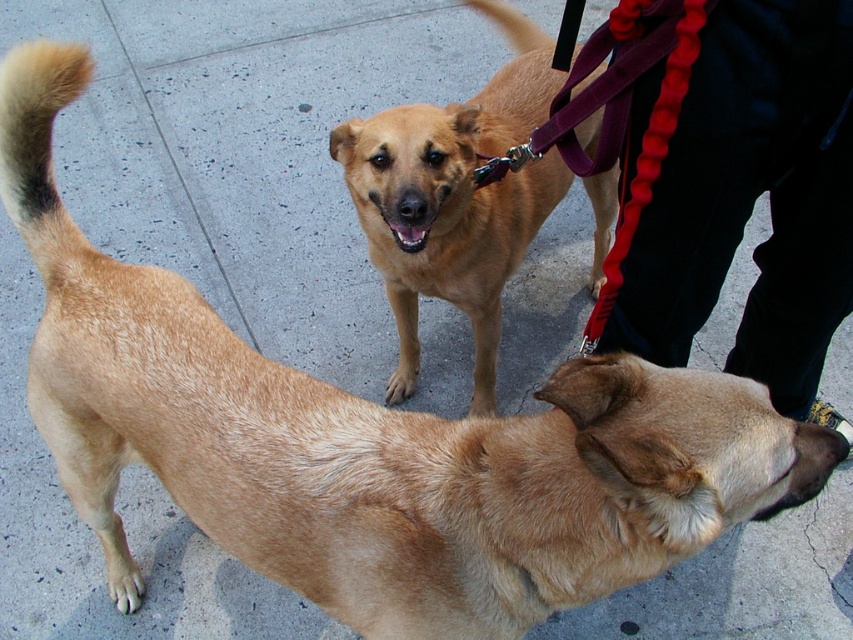
Question: Among these objects, which one is nearest to the camera?

Choices:
 (A) brown fur tail at upper left
 (B) golden fur dog at center

Answer: (A)

Question: Which point is farther to the camera?

Choices:
 (A) (51, 248)
 (B) (370, 252)

Answer: (B)

Question: Which object appears farthest from the camera in this image?

Choices:
 (A) brown fur tail at upper left
 (B) golden fur dog at center

Answer: (B)

Question: Is golden fur dog at center to the left of brown fur tail at upper left from the viewer's perspective?

Choices:
 (A) yes
 (B) no

Answer: (B)

Question: Does golden fur dog at center have a greater width compared to brown fur tail at upper left?

Choices:
 (A) yes
 (B) no

Answer: (A)

Question: Is golden fur dog at center positioned at the back of brown fur tail at upper left?

Choices:
 (A) no
 (B) yes

Answer: (B)